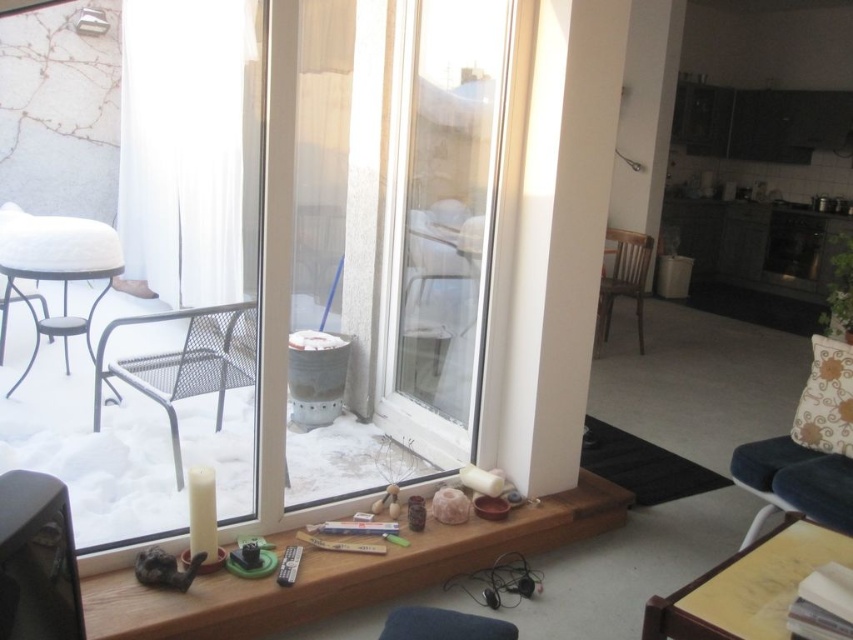
Based on the photo, you are standing in the living room and want to look outside through the transparent glass window at center. Is the wooden chair at center blocking your view of the window?

The transparent glass window at center is in front of the wooden chair at center, so the chair is behind the window and does not block your view.

You are standing in the living room and want to walk to the sliding glass doors. There are two points marked on the doors. Which point, point [173,452] or point [589,490], would you reach first as you approach the doors?

Point [173,452] is in front of point [589,490], so you would reach point [173,452] first as you approach the sliding glass doors.

Is the transparent glass window at center located in the upper half of the image?

Yes, the transparent glass window at center is located at point coordinates of (259, 252), which places it in the upper half of the image.